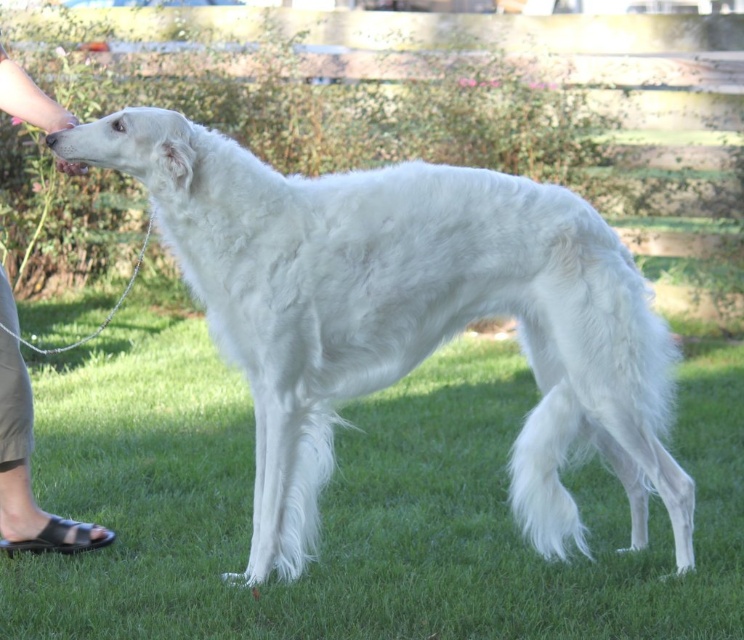
Is the position of white fluffy dog at center more distant than that of tan leather sandals at lower left?

No, it is in front of tan leather sandals at lower left.

How much distance is there between white fluffy dog at center and tan leather sandals at lower left?

4.03 feet

Does point (615, 380) come behind point (7, 301)?

No, it is not.

Identify the location of white fluffy dog at center. (404, 316).